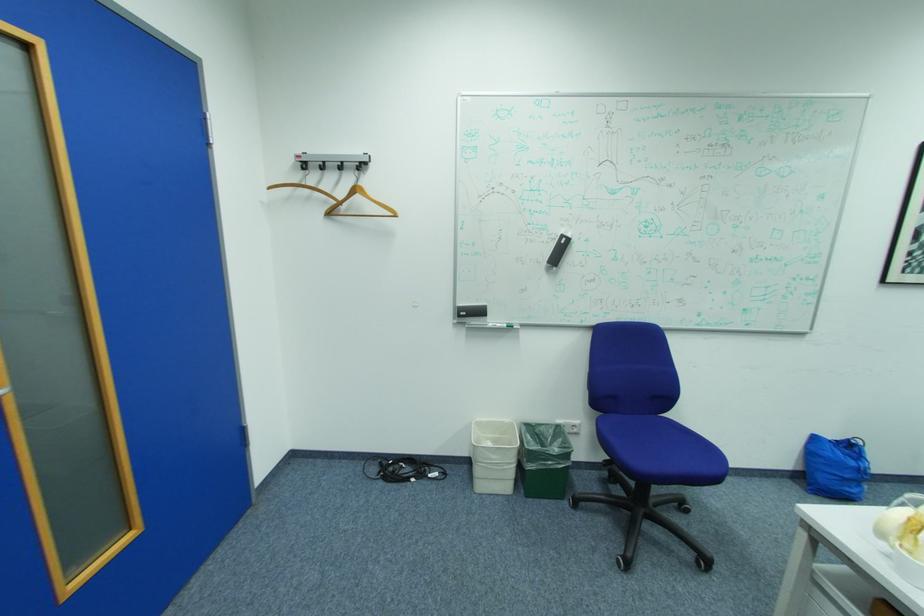
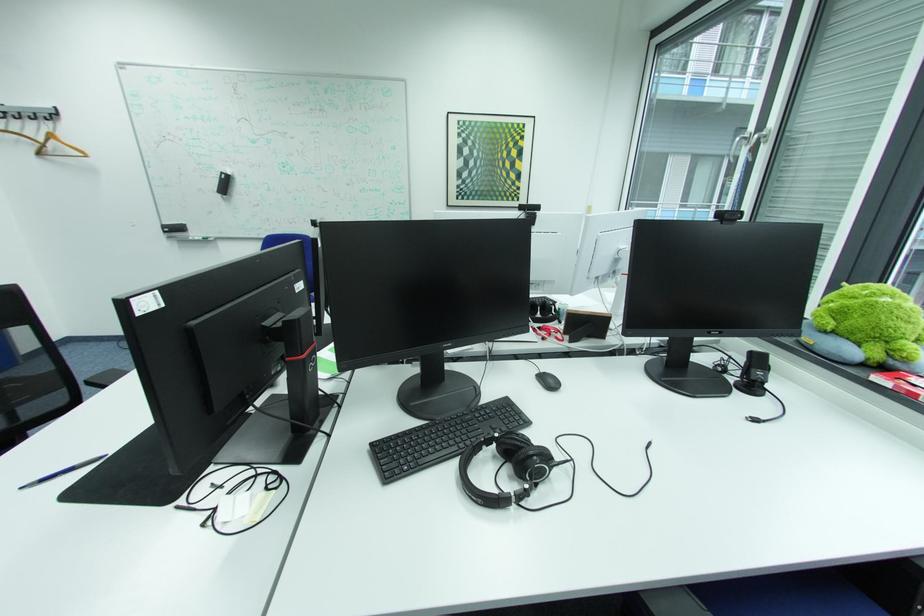
Locate, in the second image, the point that corresponds to point (337, 214) in the first image.

(49, 153)